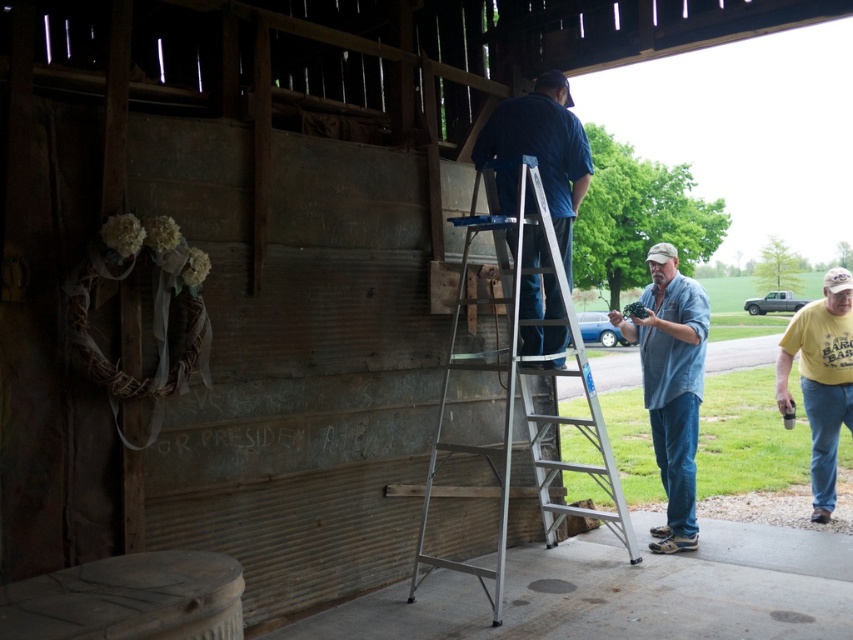
Question: Is silver metallic ladder at center bigger than yellow t-shirt at right?

Choices:
 (A) no
 (B) yes

Answer: (B)

Question: Considering the real-world distances, which object is farthest from the yellow t-shirt at right?

Choices:
 (A) silver metallic ladder at center
 (B) blue fabric shirt at upper center

Answer: (B)

Question: Which point is closer to the camera?

Choices:
 (A) (838, 376)
 (B) (569, 237)
 (C) (657, 424)
 (D) (492, 602)

Answer: (D)

Question: Which object appears closest to the camera in this image?

Choices:
 (A) yellow t-shirt at right
 (B) silver metallic ladder at center
 (C) denim shirt at center

Answer: (B)

Question: Is silver metallic ladder at center bigger than blue fabric shirt at upper center?

Choices:
 (A) yes
 (B) no

Answer: (A)

Question: Does silver metallic ladder at center come in front of blue fabric shirt at upper center?

Choices:
 (A) no
 (B) yes

Answer: (B)